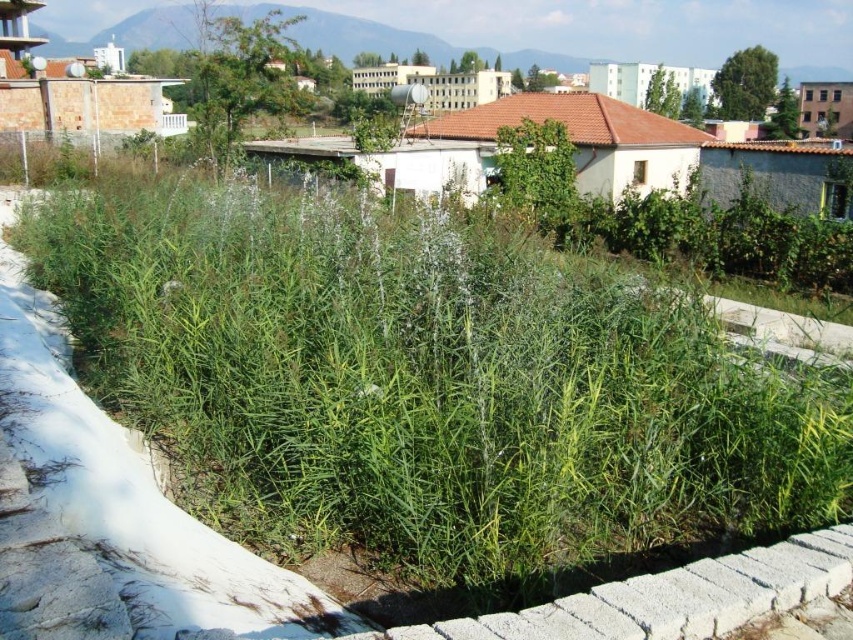
You are standing in the urban landscape scene. You see two points marked in the image. The first point is at coordinates point (440, 288) and the second is at point (358, 44). Which of these points is closer to you?

Point (440, 288) is closer to the viewer than point (358, 44).

You are a gardener who wants to trim the green leafy grass at center and the green grass at upper center. Which one should you trim first if you want to avoid damaging the one behind?

You should trim the green grass at upper center first because the green leafy grass at center is in front of it, so trimming the one behind first would prevent accidental damage to the front one.

You are a gardener who wants to trim the grass in the image. Which of the two grass areas, the green leafy grass at center or the green grass at upper center, requires trimming first based on their height?

The green leafy grass at center requires trimming first because it is shorter than the green grass at upper center, so it needs to be cut to match the desired height or maintain uniformity.